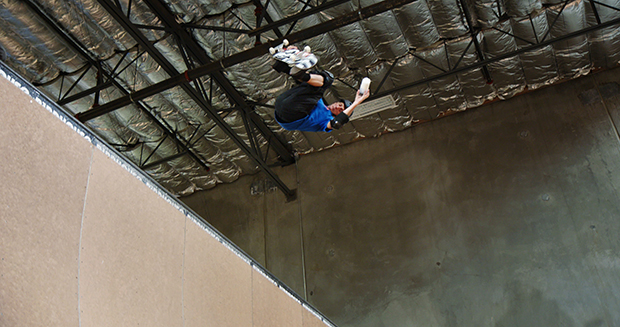
This screenshot has width=620, height=327. I want to click on wall, so click(x=479, y=236).